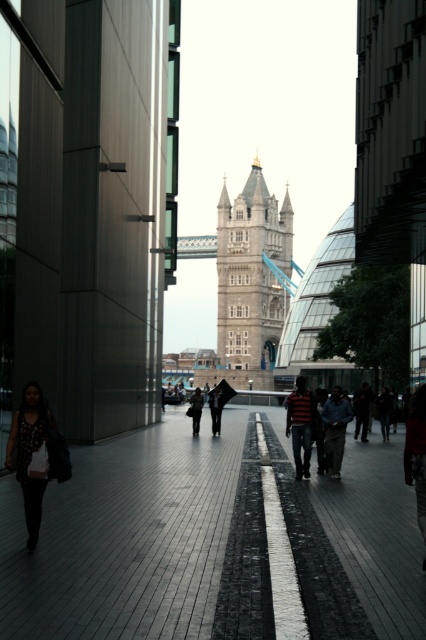
Question: Which point is closer to the camera taking this photo?

Choices:
 (A) pyautogui.click(x=83, y=628)
 (B) pyautogui.click(x=290, y=252)
 (C) pyautogui.click(x=195, y=429)
 (D) pyautogui.click(x=294, y=465)

Answer: (A)

Question: Can you confirm if stone tower at center is smaller than metallic silver suspension bridge at center?

Choices:
 (A) no
 (B) yes

Answer: (A)

Question: Which is nearer to the stone tower at center?

Choices:
 (A) polka dot dress at lower left
 (B) striped cotton shirt at center
 (C) shiny black pavement at center

Answer: (B)

Question: Which point is closer to the camera?

Choices:
 (A) polka dot dress at lower left
 (B) stone tower at center
 (C) shiny black pavement at center
 (D) dark gray jacket at center

Answer: (C)

Question: Where is shiny black pavement at center located in relation to stone tower at center in the image?

Choices:
 (A) below
 (B) above

Answer: (A)

Question: Does striped cotton shirt at center have a greater width compared to metallic silver suspension bridge at center?

Choices:
 (A) no
 (B) yes

Answer: (A)